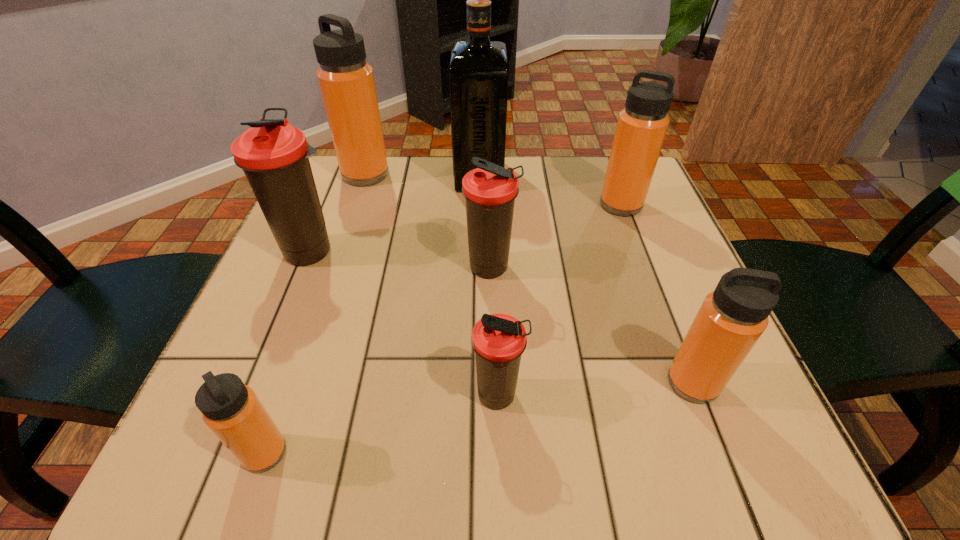
This screenshot has width=960, height=540. I want to click on liquor, so click(478, 76).

In order to click on the tallest thermos bottle in this screenshot , I will do `click(346, 81)`.

At what (x,y) coordinates should I click in order to perform the action: click on the biggest orange thermos bottle. Please return your answer as a coordinate pair (x, y). This screenshot has width=960, height=540. Looking at the image, I should click on (346, 81).

Image resolution: width=960 pixels, height=540 pixels. In order to click on the leftmost brown thermos bottle in this screenshot , I will do `click(274, 155)`.

Find the location of a particular element. the sixth nearest thermos bottle is located at coordinates (641, 127).

Where is `the third nearest orange thermos bottle`? the third nearest orange thermos bottle is located at coordinates (641, 127).

I want to click on the second smallest brown thermos bottle, so click(x=490, y=190).

Where is `the second smallest orange thermos bottle`? This screenshot has height=540, width=960. the second smallest orange thermos bottle is located at coordinates (732, 318).

Find the location of a particular element. the smallest brown thermos bottle is located at coordinates (499, 340).

Identify the location of the smallest orange thermos bottle. (232, 410).